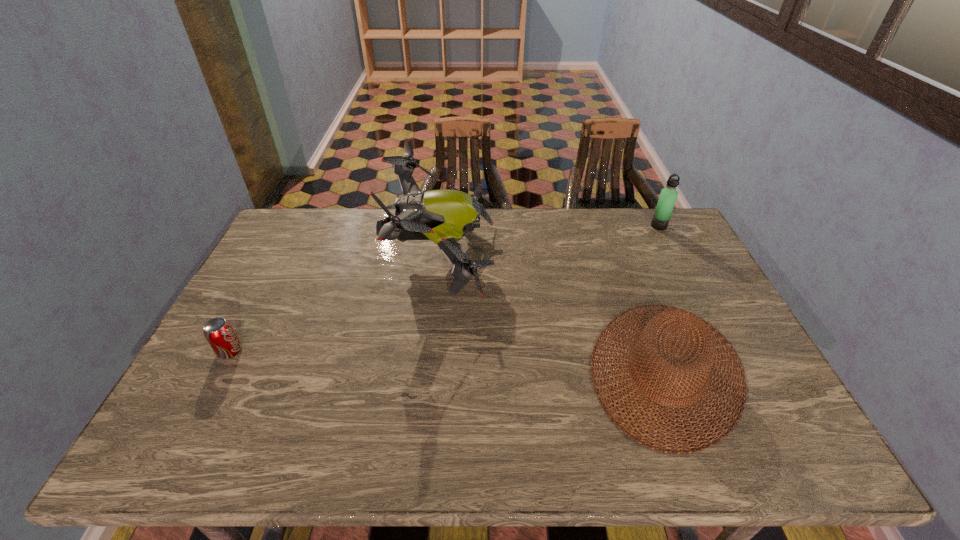
You are a GUI agent. You are given a task and a screenshot of the screen. Output one action in this format:
    pyautogui.click(x=<x>, y=<y>)
    Task: Click on the vacant position at the left edge of the desktop
    The image size is (960, 540).
    Given the screenshot: What is the action you would take?
    pyautogui.click(x=272, y=248)

Locate an element on the screen. free location at the right edge is located at coordinates (677, 274).

The height and width of the screenshot is (540, 960). I want to click on free point at the far left corner, so click(x=331, y=210).

The width and height of the screenshot is (960, 540). In order to click on free region at the far right corner of the desktop in this screenshot , I will do `click(647, 241)`.

Locate an element on the screen. unoccupied area between the thermos bottle and the soda can is located at coordinates (444, 289).

Image resolution: width=960 pixels, height=540 pixels. In order to click on unoccupied position between the drone and the soda can in this screenshot , I will do `click(336, 304)`.

This screenshot has height=540, width=960. In order to click on free space between the leftmost object and the third object from right to left in this screenshot , I will do `click(336, 304)`.

Locate an element on the screen. The width and height of the screenshot is (960, 540). vacant space in between the thermos bottle and the second shortest object is located at coordinates (662, 298).

At what (x,y) coordinates should I click in order to perform the action: click on vacant space that is in between the tallest object and the shortest object. Please return your answer as a coordinate pair (x, y). Image resolution: width=960 pixels, height=540 pixels. Looking at the image, I should click on (336, 304).

Locate an element on the screen. This screenshot has height=540, width=960. empty space that is in between the third tallest object and the third object from right to left is located at coordinates (554, 313).